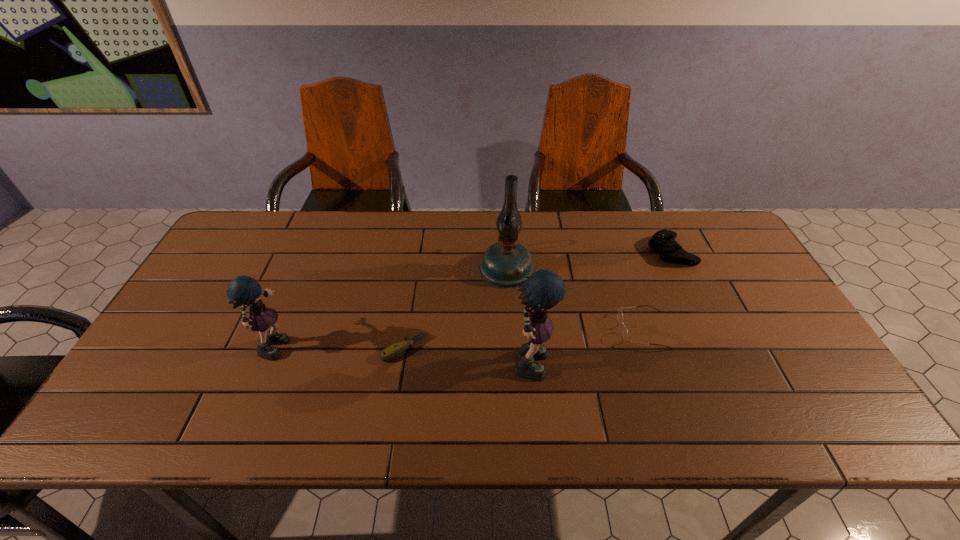
All rag dolls are currently evenly spaced. To continue this pattern, where would you add another rag doll on the right? Please point out a vacant spot. Please provide its 2D coordinates. Your answer should be formatted as a tuple, i.e. [(x, y)], where the tuple contains the x and y coordinates of a point satisfying the conditions above.

[(801, 373)]